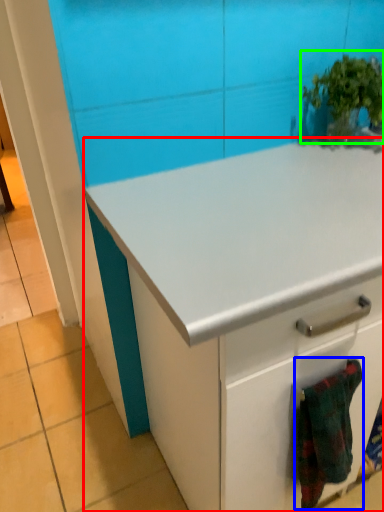
Question: Which object is the farthest from cabinetry (highlighted by a red box)? Choose among these: blanket (highlighted by a blue box) or houseplant (highlighted by a green box).

Choices:
 (A) blanket
 (B) houseplant

Answer: (B)